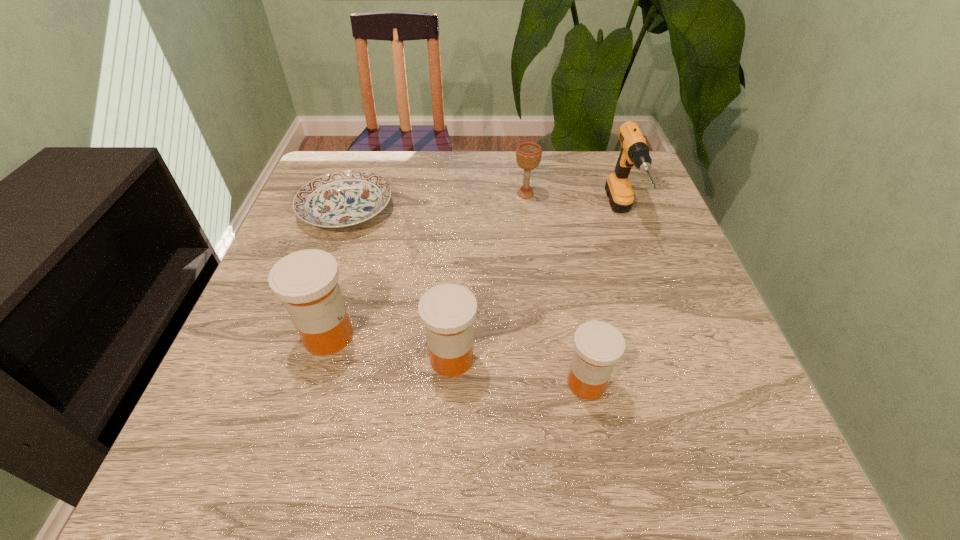
Where is `vacant space located at the tip of the rightmost object`? vacant space located at the tip of the rightmost object is located at coordinates (654, 303).

Where is `chalice located in the far edge section of the desktop`? chalice located in the far edge section of the desktop is located at coordinates (528, 154).

Locate an element on the screen. Image resolution: width=960 pixels, height=540 pixels. plate at the far edge is located at coordinates (343, 198).

Find the location of a particular element. This screenshot has height=540, width=960. drill that is at the far edge is located at coordinates (634, 151).

Locate an element on the screen. The width and height of the screenshot is (960, 540). medicine present at the left edge is located at coordinates (306, 281).

You are a GUI agent. You are given a task and a screenshot of the screen. Output one action in this format:
    pyautogui.click(x=<x>, y=<y>)
    Task: Click on the plate that is at the left edge
    The height and width of the screenshot is (540, 960).
    Given the screenshot: What is the action you would take?
    pyautogui.click(x=343, y=198)

At what (x,y) coordinates should I click in order to perform the action: click on object present at the right edge. Please return your answer as a coordinate pair (x, y). The height and width of the screenshot is (540, 960). Looking at the image, I should click on (634, 151).

Find the location of a particular element. This screenshot has height=540, width=960. object located in the far left corner section of the desktop is located at coordinates (343, 198).

Where is `object situated at the far right corner`? Image resolution: width=960 pixels, height=540 pixels. object situated at the far right corner is located at coordinates (634, 151).

I want to click on vacant region at the far edge of the desktop, so click(x=442, y=157).